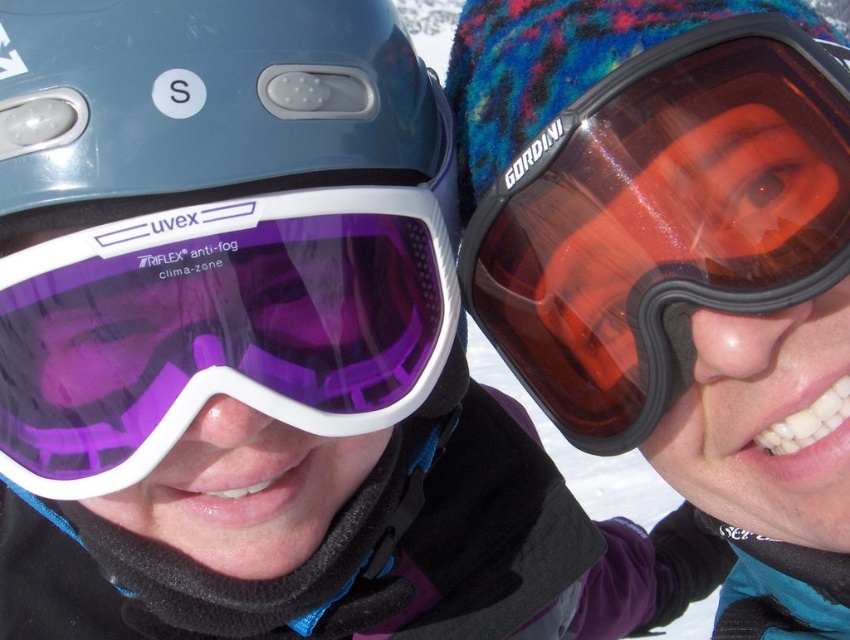
Question: Which point is farther to the camera?

Choices:
 (A) translucent amber lens goggles at right
 (B) purple matte ski goggles at left

Answer: (A)

Question: Among these points, which one is nearest to the camera?

Choices:
 (A) (219, 358)
 (B) (476, 224)

Answer: (A)

Question: Is translucent amber lens goggles at right smaller than purple matte ski goggles at left?

Choices:
 (A) yes
 (B) no

Answer: (B)

Question: Is translucent amber lens goggles at right further to camera compared to purple matte ski goggles at left?

Choices:
 (A) no
 (B) yes

Answer: (B)

Question: Does translucent amber lens goggles at right have a larger size compared to purple matte ski goggles at left?

Choices:
 (A) no
 (B) yes

Answer: (B)